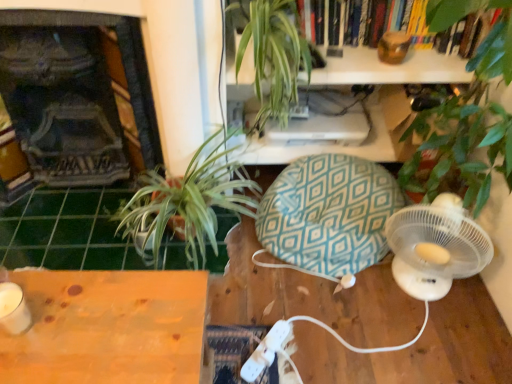
The height and width of the screenshot is (384, 512). In order to click on free space in front of teal diamond-patterned bean bag chair at center in this screenshot , I will do `click(338, 329)`.